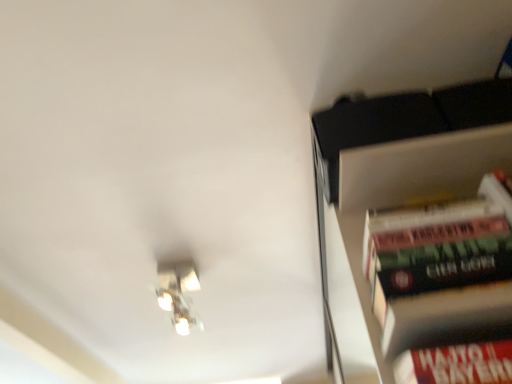
Question: Would you say hardcover book at right is to the left or to the right of metallic silver light fixture at upper left in the picture?

Choices:
 (A) right
 (B) left

Answer: (A)

Question: Considering the positions of hardcover book at right and metallic silver light fixture at upper left in the image, is hardcover book at right taller or shorter than metallic silver light fixture at upper left?

Choices:
 (A) short
 (B) tall

Answer: (B)

Question: Looking at the image, does hardcover book at right seem bigger or smaller compared to metallic silver light fixture at upper left?

Choices:
 (A) small
 (B) big

Answer: (A)

Question: Is metallic silver light fixture at upper left wider or thinner than hardcover book at right?

Choices:
 (A) wide
 (B) thin

Answer: (A)

Question: Based on their sizes in the image, would you say metallic silver light fixture at upper left is bigger or smaller than hardcover book at right?

Choices:
 (A) big
 (B) small

Answer: (A)

Question: Visually, is metallic silver light fixture at upper left positioned to the left or to the right of hardcover book at right?

Choices:
 (A) left
 (B) right

Answer: (A)

Question: From a real-world perspective, is metallic silver light fixture at upper left positioned above or below hardcover book at right?

Choices:
 (A) above
 (B) below

Answer: (A)